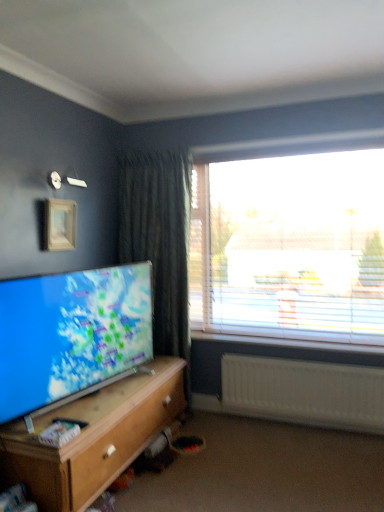
This screenshot has height=512, width=384. I want to click on matte screen tv at lower left, so click(x=71, y=334).

What do you see at coordinates (93, 438) in the screenshot?
I see `wooden cabinet at lower left` at bounding box center [93, 438].

Locate an element on the screen. This screenshot has height=512, width=384. wooden picture frame at upper left is located at coordinates (60, 224).

This screenshot has height=512, width=384. Describe the element at coordinates (304, 392) in the screenshot. I see `white plastic radiator at lower right` at that location.

Where is `white plastic window sill at right`? This screenshot has height=512, width=384. white plastic window sill at right is located at coordinates (288, 342).

Can you see matte screen tv at lower left touching wooden picture frame at upper left?

No, matte screen tv at lower left is not in contact with wooden picture frame at upper left.

Who is bigger, matte screen tv at lower left or wooden picture frame at upper left?

matte screen tv at lower left is bigger.

Consider the image. Is matte screen tv at lower left outside of wooden picture frame at upper left?

matte screen tv at lower left lies outside wooden picture frame at upper left's area.

From a real-world perspective, which is physically above, matte screen tv at lower left or wooden picture frame at upper left?

wooden picture frame at upper left is physically above.

Is black plastic remote control at lower left not near matte screen tv at lower left?

No, black plastic remote control at lower left is in close proximity to matte screen tv at lower left.

Which is behind, point (71, 423) or point (21, 286)?

The point (21, 286) is behind.

Considering the sizes of black plastic remote control at lower left and matte screen tv at lower left in the image, is black plastic remote control at lower left bigger or smaller than matte screen tv at lower left?

Clearly, black plastic remote control at lower left is smaller in size than matte screen tv at lower left.

Is black plastic remote control at lower left positioned with its back to matte screen tv at lower left?

Correct, black plastic remote control at lower left is looking away from matte screen tv at lower left.

Can we say transparent plastic window at upper right lies outside matte screen tv at lower left?

That's correct, transparent plastic window at upper right is outside of matte screen tv at lower left.

From the image's perspective, which is below, transparent plastic window at upper right or matte screen tv at lower left?

From the image's view, matte screen tv at lower left is below.

Which object is further away from the camera, transparent plastic window at upper right or matte screen tv at lower left?

transparent plastic window at upper right.

From a real-world perspective, relative to matte screen tv at lower left, is transparent plastic window at upper right vertically above or below?

From a real-world perspective, transparent plastic window at upper right is physically above matte screen tv at lower left.

From a real-world perspective, is wooden cabinet at lower left above or below black plastic remote control at lower left?

In terms of real-world spatial position, wooden cabinet at lower left is below black plastic remote control at lower left.

In order to click on remote control on the left side of wooden cabinet at lower left in this screenshot , I will do `click(71, 421)`.

From the picture: Considering the sizes of objects wooden cabinet at lower left and black plastic remote control at lower left in the image provided, who is smaller, wooden cabinet at lower left or black plastic remote control at lower left?

With smaller size is black plastic remote control at lower left.

Is wooden cabinet at lower left not close to black plastic remote control at lower left?

No.

Does white plastic radiator at lower right turn towards transparent plastic window at upper right?

No.

Which of these two, white plastic radiator at lower right or transparent plastic window at upper right, is wider?

With larger width is white plastic radiator at lower right.

From a real-world perspective, between white plastic radiator at lower right and transparent plastic window at upper right, who is vertically higher?

transparent plastic window at upper right.

Considering the positions of objects white plastic radiator at lower right and transparent plastic window at upper right in the image provided, who is in front, white plastic radiator at lower right or transparent plastic window at upper right?

white plastic radiator at lower right.

In terms of width, does white plastic window sill at right look wider or thinner when compared to matte screen tv at lower left?

Considering their sizes, white plastic window sill at right looks broader than matte screen tv at lower left.

Is white plastic window sill at right completely or partially outside of matte screen tv at lower left?

Yes.

Is white plastic window sill at right at the right side of matte screen tv at lower left?

Indeed, white plastic window sill at right is positioned on the right side of matte screen tv at lower left.

Is white plastic window sill at right in front of matte screen tv at lower left?

No, it is not.

Would you say white plastic radiator at lower right is a long distance from wooden cabinet at lower left?

Yes.

Is white plastic radiator at lower right further to the viewer compared to wooden cabinet at lower left?

Yes, white plastic radiator at lower right is further from the camera.

Is white plastic radiator at lower right completely or partially outside of wooden cabinet at lower left?

Indeed, white plastic radiator at lower right is completely outside wooden cabinet at lower left.

Based on the photo, from the image's perspective, which is below, white plastic radiator at lower right or wooden cabinet at lower left?

wooden cabinet at lower left.

The image size is (384, 512). Find the location of `picture frame on the left side of matte screen tv at lower left`. picture frame on the left side of matte screen tv at lower left is located at coordinates (60, 224).

Identify the location of remote control below the matte screen tv at lower left (from the image's perspective). (71, 421).

Looking at the image, which one is located further to wooden picture frame at upper left, transparent plastic window at upper right or wooden cabinet at lower left?

transparent plastic window at upper right lies further to wooden picture frame at upper left than the other object.

Looking at the image, which one is located closer to white plastic radiator at lower right, black plastic remote control at lower left or wooden picture frame at upper left?

black plastic remote control at lower left is positioned closer to the anchor white plastic radiator at lower right.

When comparing their distances from matte screen tv at lower left, does white plastic radiator at lower right or wooden picture frame at upper left seem closer?

wooden picture frame at upper left is positioned closer to the anchor matte screen tv at lower left.

In the scene shown: Looking at the image, which one is located closer to matte screen tv at lower left, wooden cabinet at lower left or white plastic window sill at right?

Among the two, wooden cabinet at lower left is located nearer to matte screen tv at lower left.

Considering their positions, is transparent plastic window at upper right positioned closer to matte screen tv at lower left than wooden picture frame at upper left?

Based on the image, wooden picture frame at upper left appears to be nearer to matte screen tv at lower left.

Consider the image. Based on their spatial positions, is white plastic radiator at lower right or transparent plastic window at upper right closer to black plastic remote control at lower left?

white plastic radiator at lower right is closer to black plastic remote control at lower left.

Which object lies further to the anchor point black plastic remote control at lower left, white plastic radiator at lower right or wooden picture frame at upper left?

white plastic radiator at lower right is positioned further to the anchor black plastic remote control at lower left.

When comparing their distances from white plastic window sill at right, does transparent plastic window at upper right or white plastic radiator at lower right seem further?

transparent plastic window at upper right lies further to white plastic window sill at right than the other object.

Where is `window sill between black plastic remote control at lower left and transparent plastic window at upper right in the horizontal direction`? The height and width of the screenshot is (512, 384). window sill between black plastic remote control at lower left and transparent plastic window at upper right in the horizontal direction is located at coordinates (288, 342).

The width and height of the screenshot is (384, 512). I want to click on remote control between wooden picture frame at upper left and transparent plastic window at upper right from left to right, so click(71, 421).

Identify the location of window between black plastic remote control at lower left and white plastic radiator at lower right from left to right. This screenshot has height=512, width=384. pos(290,247).

What are the coordinates of `remote control between matte screen tv at lower left and wooden cabinet at lower left in the vertical direction` in the screenshot? It's located at (71, 421).